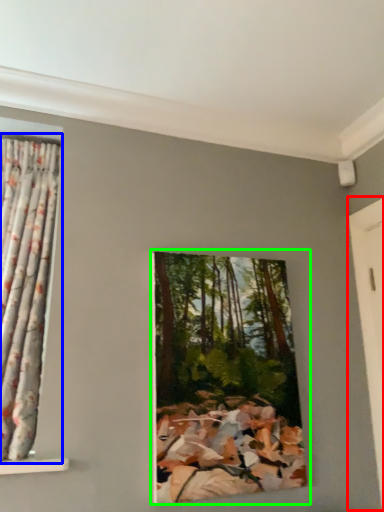
Question: Which is farther away from door (highlighted by a red box)? curtain (highlighted by a blue box) or oil painting (highlighted by a green box)?

Choices:
 (A) curtain
 (B) oil painting

Answer: (A)